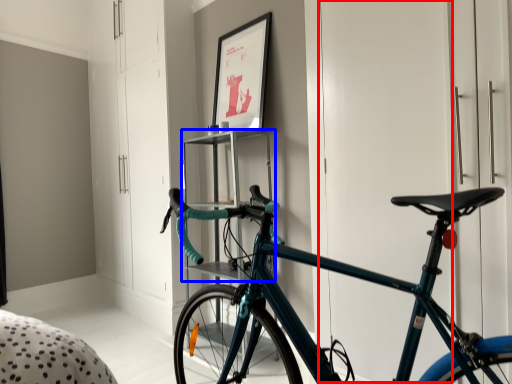
Question: Among these objects, which one is nearest to the camera, door (highlighted by a red box) or shelf (highlighted by a blue box)?

Choices:
 (A) door
 (B) shelf

Answer: (A)